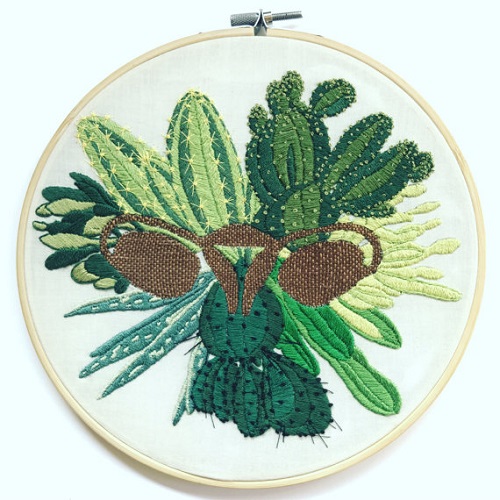
Locate an element on the screen. Image resolution: width=500 pixels, height=500 pixels. frame is located at coordinates (238, 30).